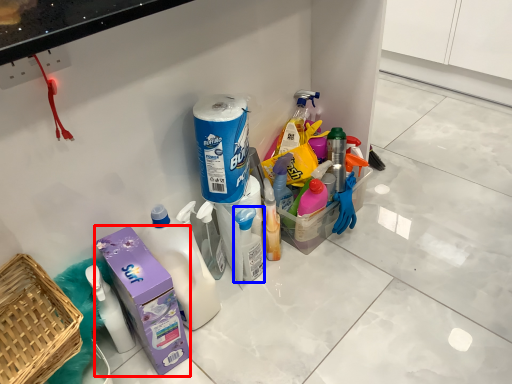
Question: Which of the following is the closest to the observer, carton (highlighted by a red box) or cleaning product (highlighted by a blue box)?

Choices:
 (A) carton
 (B) cleaning product

Answer: (A)